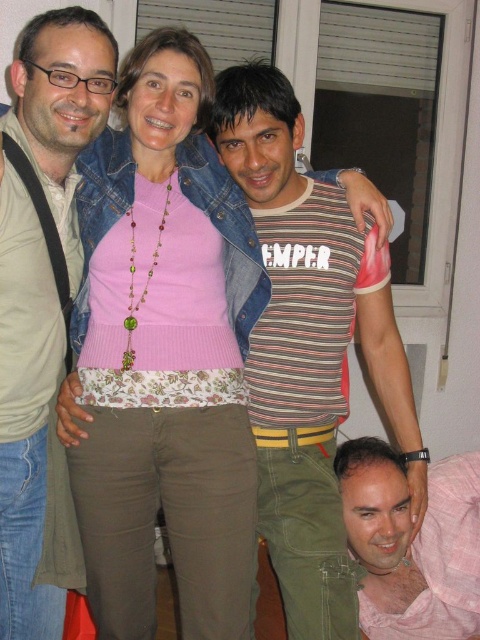
From the picture: Based on the scene description, which object is taller between the striped cotton shirt at center and the pink fabric shirt at lower right?

The striped cotton shirt at center is taller than the pink fabric shirt at lower right according to the description.

You are trying to decide which of the two shirts, the matte black shirt at left or the pink fabric shirt at lower right, would be easier to slip on through a narrow doorway. Based on their thickness, which one would you choose?

The matte black shirt at left is thinner than the pink fabric shirt at lower right, so it would be easier to slip on through a narrow doorway.

You are standing in front of the group and want to hand a gift to the person wearing the striped cotton shirt at center and the matte black shirt at left. Which one is closer to you?

The striped cotton shirt at center is closer to you than the matte black shirt at left.